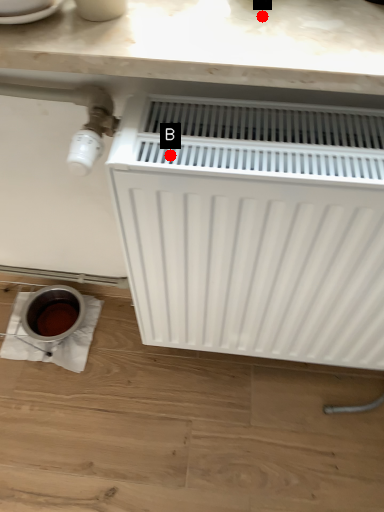
Question: Two points are circled on the image, labeled by A and B beside each circle. Which point is further to the camera?

Choices:
 (A) A is further
 (B) B is further

Answer: (A)